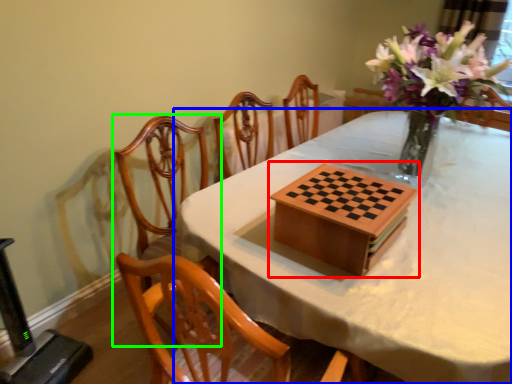
Question: Based on their relative distances, which object is nearer to board game (highlighted by a red box)? Choose from table (highlighted by a blue box) and chair (highlighted by a green box).

Choices:
 (A) table
 (B) chair

Answer: (A)